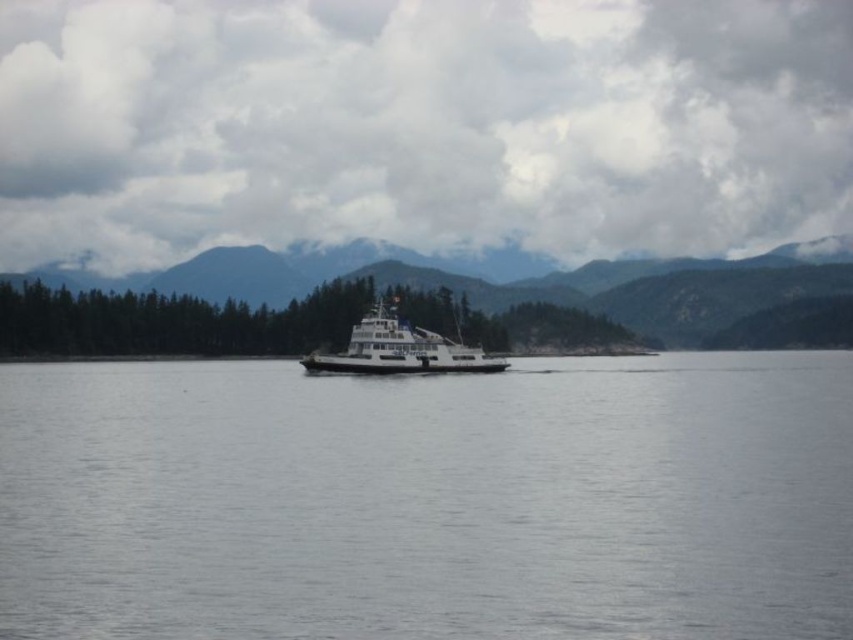
Describe the element at coordinates (428, 500) in the screenshot. Image resolution: width=853 pixels, height=640 pixels. I see `clear water at center` at that location.

Image resolution: width=853 pixels, height=640 pixels. In order to click on clear water at center in this screenshot , I will do `click(428, 500)`.

Which is more to the right, clear water at center or green forested mountain at center?

green forested mountain at center is more to the right.

Does point (461, 500) lie behind point (606, 304)?

No, it is not.

Find the location of a particular element. This screenshot has height=640, width=853. clear water at center is located at coordinates (428, 500).

Is green forested mountain at center to the left of white matte ferry at center from the viewer's perspective?

Incorrect, green forested mountain at center is not on the left side of white matte ferry at center.

Measure the distance between green forested mountain at center and white matte ferry at center.

74.22 meters

Measure the distance between point (166, 276) and camera.

Point (166, 276) and camera are 1062.73 feet apart.

I want to click on green forested mountain at center, so click(444, 305).